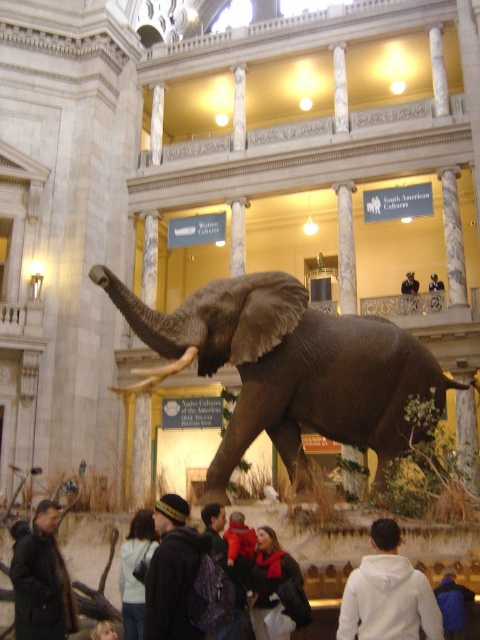
Can you confirm if white fleece jacket at lower center is positioned below blue fuzzy jacket at lower right?

No.

Locate an element on the screen. Image resolution: width=480 pixels, height=640 pixels. white fleece jacket at lower center is located at coordinates (387, 593).

Who is more forward, (348,618) or (451,576)?

Point (348,618) is more forward.

This screenshot has width=480, height=640. I want to click on white fleece jacket at lower center, so click(387, 593).

Who is positioned more to the left, white fleece jacket at lower center or smooth black jacket at center?

Positioned to the left is white fleece jacket at lower center.

You are a GUI agent. You are given a task and a screenshot of the screen. Output one action in this format:
    pyautogui.click(x=<x>, y=<y>)
    Task: Click on the white fleece jacket at lower center
    The width and height of the screenshot is (480, 640).
    Given the screenshot: What is the action you would take?
    pyautogui.click(x=387, y=593)

Between point (362, 609) and point (432, 291), which one is positioned in front?

Point (362, 609) is more forward.

Find the location of a particular element. white fleece jacket at lower center is located at coordinates (387, 593).

Between dark brown leather jacket at lower left and smooth black jacket at center, which one has less height?

dark brown leather jacket at lower left

Is dark brown leather jacket at lower left closer to the viewer compared to smooth black jacket at center?

Yes.

What do you see at coordinates (40, 579) in the screenshot? This screenshot has width=480, height=640. I see `dark brown leather jacket at lower left` at bounding box center [40, 579].

This screenshot has width=480, height=640. Find the location of `dark brown leather jacket at lower left`. dark brown leather jacket at lower left is located at coordinates (40, 579).